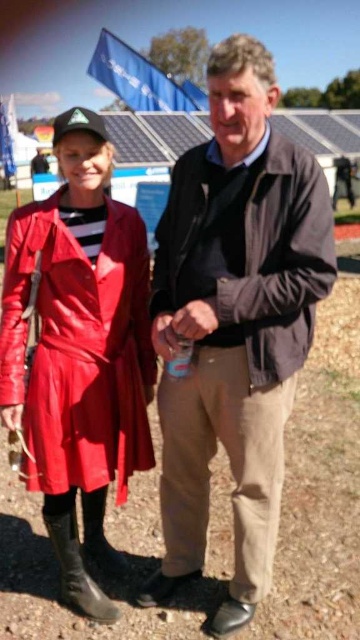
Is dirt field at center further to camera compared to black leather boot at lower left?

Yes, it is behind black leather boot at lower left.

Between point (338, 506) and point (66, 586), which one is positioned behind?

The point (338, 506) is more distant.

This screenshot has height=640, width=360. Find the location of `dirt field at center`. dirt field at center is located at coordinates (321, 481).

Can you confirm if brown leather jacket at center is positioned to the right of matte leather coat at left?

Yes, brown leather jacket at center is to the right of matte leather coat at left.

Between point (218, 336) and point (124, 227), which one is positioned in front?

Positioned in front is point (218, 336).

The image size is (360, 640). I want to click on brown leather jacket at center, so click(235, 323).

Who is positioned more to the right, brown leather jacket at center or black leather boot at lower left?

Positioned to the right is brown leather jacket at center.

Is point (270, 92) positioned behind point (77, 608)?

No, it is not.

Is point (232, 266) closer to viewer compared to point (65, 552)?

Yes, point (232, 266) is closer to viewer.

Identify the location of brown leather jacket at center. (235, 323).